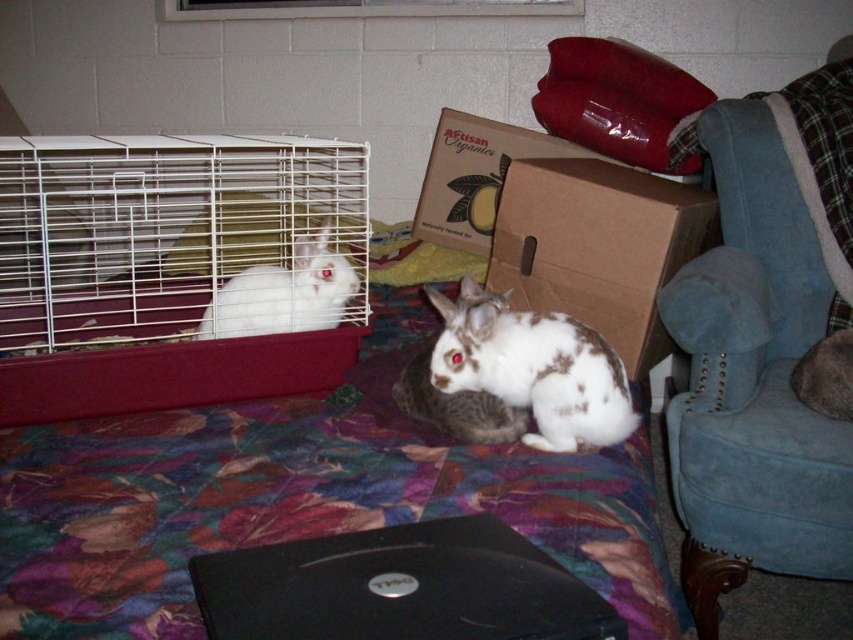
You are a small toy mouse that is 10 cm tall. You want to hide behind the white wire cage at left to avoid being seen by the white fur rabbit at left. Will you be completely hidden from its view?

The white wire cage at left is taller than the white fur rabbit at left, so yes, the toy mouse can hide completely behind the white wire cage at left as it is taller than the rabbit.